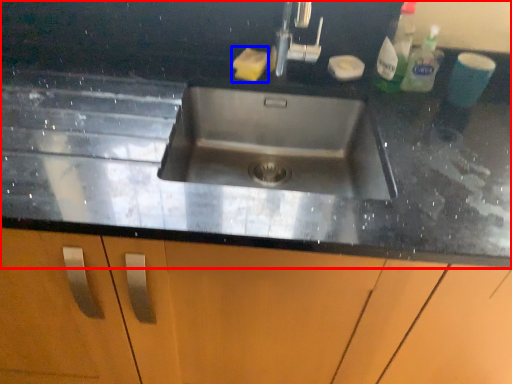
Question: Which point is closer to the camera, countertop (highlighted by a red box) or soap (highlighted by a blue box)?

Choices:
 (A) countertop
 (B) soap

Answer: (A)